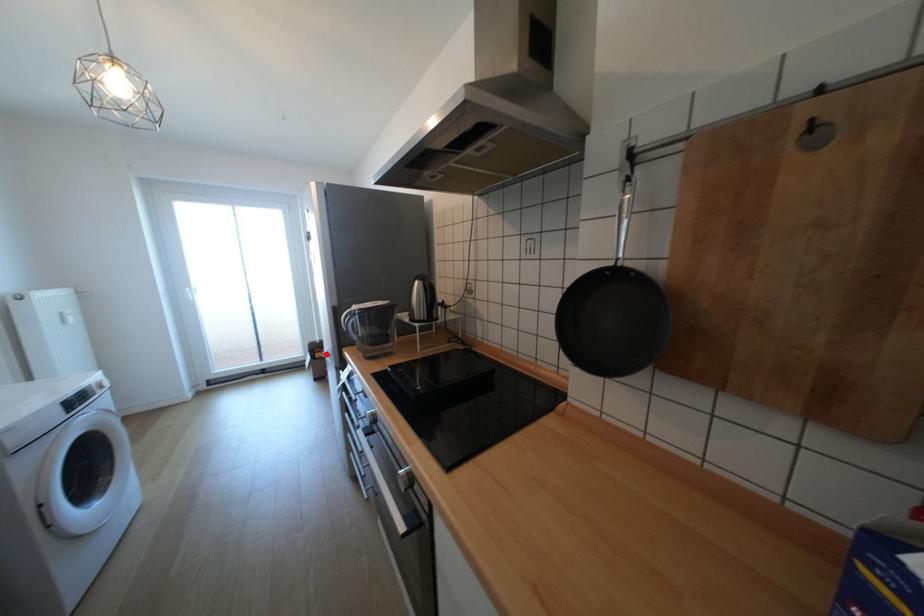
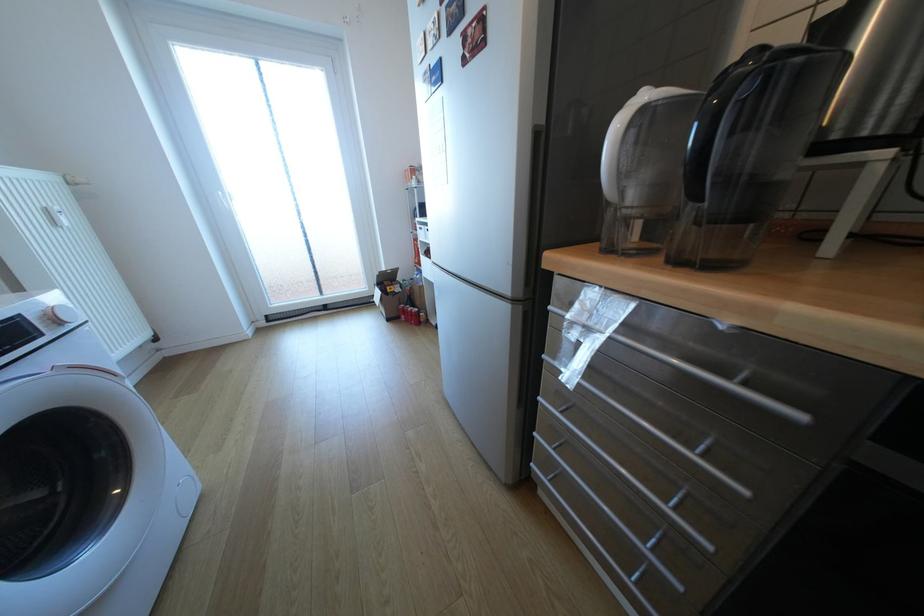
Question: I am providing you with two images of the same scene from different viewpoints. In image1, a red point is highlighted. Considering the same 3D point in image2, which of the following is correct?

Choices:
 (A) It is closer
 (B) It is farther

Answer: (A)